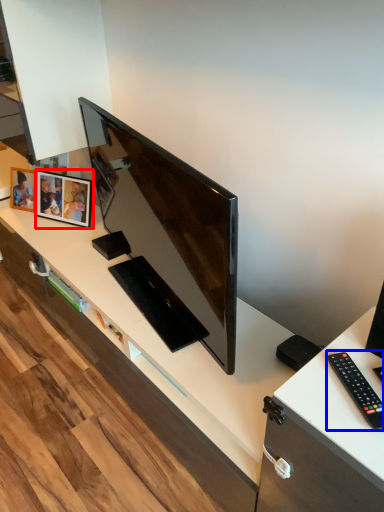
Question: Which point is further to the camera, picture frame (highlighted by a red box) or remote control (highlighted by a blue box)?

Choices:
 (A) picture frame
 (B) remote control

Answer: (A)